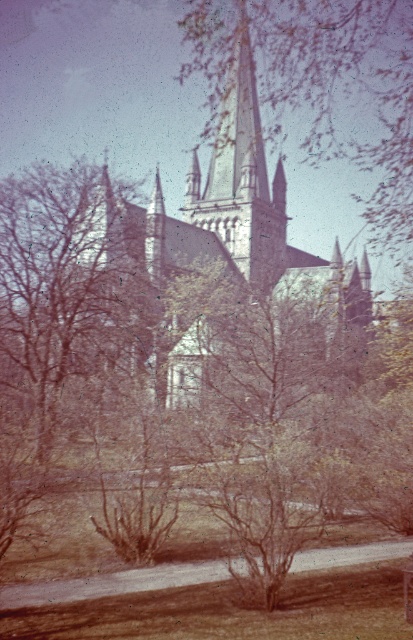
How far apart are gray stone church at center and smooth stone tower at center?

The distance of gray stone church at center from smooth stone tower at center is 9.17 feet.

This screenshot has width=413, height=640. Describe the element at coordinates (247, 211) in the screenshot. I see `gray stone church at center` at that location.

Locate an element on the screen. The width and height of the screenshot is (413, 640). gray stone church at center is located at coordinates (247, 211).

Between brown leafy tree at left and smooth gray steeple at center, which one is positioned higher?

smooth gray steeple at center

Does brown leafy tree at left have a smaller size compared to smooth gray steeple at center?

Indeed, brown leafy tree at left has a smaller size compared to smooth gray steeple at center.

Which is in front, point (137, 316) or point (382, 241)?

Positioned in front is point (137, 316).

In order to click on brown leafy tree at left in this screenshot , I will do `click(69, 285)`.

Does brown leafy tree at left have a smaller size compared to gray stone church at center?

Yes, brown leafy tree at left is smaller than gray stone church at center.

Consider the image. Is brown leafy tree at left to the left of gray stone church at center from the viewer's perspective?

→ Yes, brown leafy tree at left is to the left of gray stone church at center.

Between point (149, 346) and point (370, 269), which one is positioned behind?

Positioned behind is point (370, 269).

At what (x,y) coordinates should I click in order to perform the action: click on brown leafy tree at left. Please return your answer as a coordinate pair (x, y). Looking at the image, I should click on (69, 285).